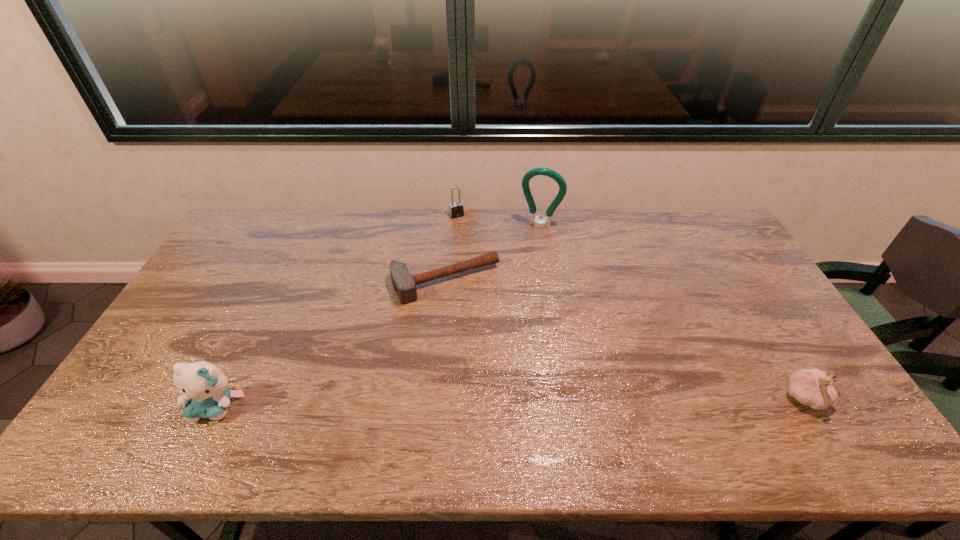
At what (x,y) coordinates should I click in order to perform the action: click on kitten present at the near edge. Please return your answer as a coordinate pair (x, y). Looking at the image, I should click on (x=204, y=387).

Identify the location of garlic at the near edge. This screenshot has height=540, width=960. (811, 387).

Find the location of a particular element. This screenshot has height=540, width=960. object that is at the right edge is located at coordinates (811, 387).

At what (x,y) coordinates should I click in order to perform the action: click on object at the near right corner. Please return your answer as a coordinate pair (x, y). Image resolution: width=960 pixels, height=540 pixels. Looking at the image, I should click on (811, 387).

Where is `vacant space at the far edge of the desktop`? vacant space at the far edge of the desktop is located at coordinates (380, 215).

In the image, there is a desktop. Where is `free space at the near edge`? The image size is (960, 540). free space at the near edge is located at coordinates (477, 385).

Image resolution: width=960 pixels, height=540 pixels. I want to click on vacant space at the right edge of the desktop, so click(724, 266).

Where is `free space at the near left corner`? The image size is (960, 540). free space at the near left corner is located at coordinates (124, 407).

Locate an element on the screen. Image resolution: width=960 pixels, height=540 pixels. vacant space at the far right corner of the desktop is located at coordinates (706, 247).

Find the location of a particular element. This screenshot has height=540, width=960. unoccupied area between the padlock and the shortest object is located at coordinates (451, 248).